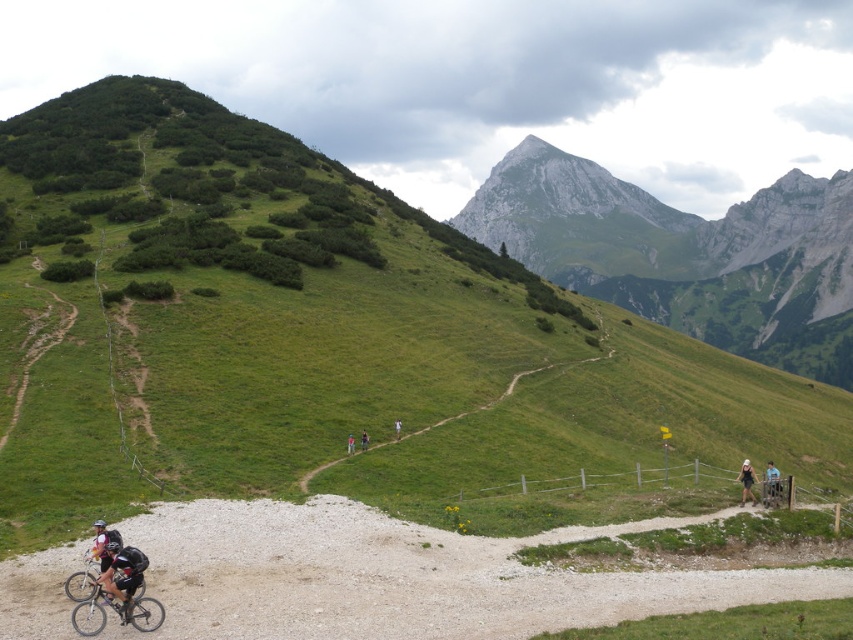
You are standing at the starting point of the gravel path and want to take a photo of both the black matte cycling suit at lower left and the white fabric person at center in the same frame. Given that your camera has a 50mm lens, which has a field of view that can capture objects up to 100 feet apart, will you be able to include both subjects in a single photo?

The black matte cycling suit at lower left is 90.56 feet away from the white fabric person at center. Since the distance between them is within the 100 feet field of view of the 50mm lens, you can capture both subjects in a single photo.